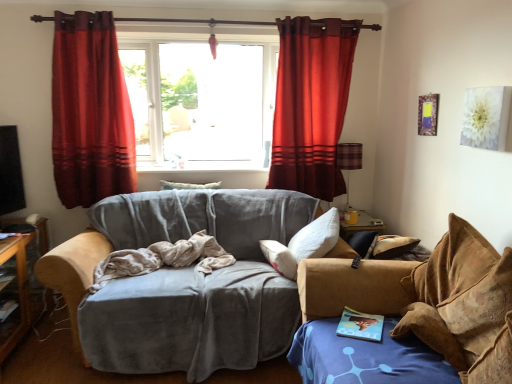
Question: From a real-world perspective, is beige fabric blanket at center positioned above or below rich red velvet curtain at upper center, positioned as the 2th curtain in left-to-right order?

Choices:
 (A) above
 (B) below

Answer: (B)

Question: In terms of height, does beige fabric blanket at center look taller or shorter compared to rich red velvet curtain at upper center, positioned as the 2th curtain in left-to-right order?

Choices:
 (A) tall
 (B) short

Answer: (B)

Question: Which object is positioned closest to the brown suede studio couch at right, the first studio couch positioned from the right?

Choices:
 (A) white soft pillow at center
 (B) rich red velvet curtain at upper center, acting as the 1th curtain starting from the right
 (C) red velvet curtain at left, marked as the first curtain in a left-to-right arrangement
 (D) beige fabric blanket at center
 (E) transparent glass window at center

Answer: (D)

Question: Estimate the real-world distances between objects in this image. Which object is closer to the beige fabric blanket at center?

Choices:
 (A) red velvet curtain at left, marked as the first curtain in a left-to-right arrangement
 (B) white soft pillow at center
 (C) velvet gray couch at center, acting as the 1th studio couch starting from the left
 (D) plaid fabric lampshade at right
 (E) brown suede studio couch at right, the first studio couch positioned from the right

Answer: (C)